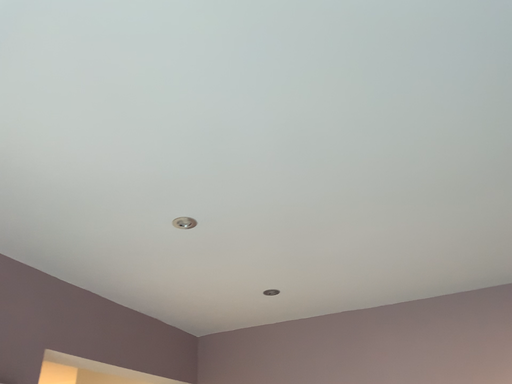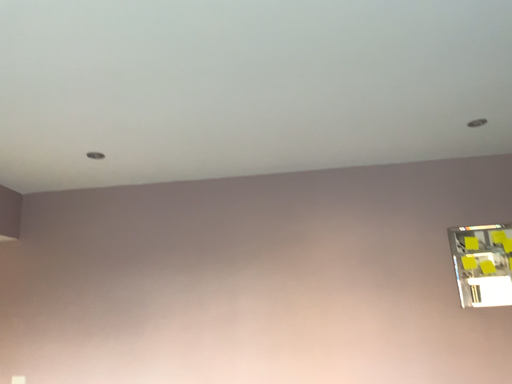
Question: How did the camera likely rotate when shooting the video?

Choices:
 (A) rotated left
 (B) rotated right

Answer: (B)